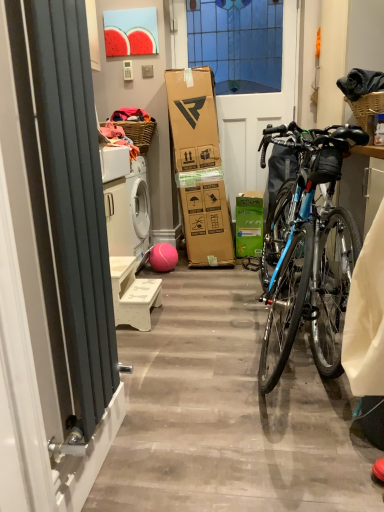
Question: Is woven brown picnic basket at upper center, the second picnic basket viewed from the front, in front of or behind rubber ball at center in the image?

Choices:
 (A) front
 (B) behind

Answer: (A)

Question: Would you say woven brown picnic basket at upper center, which is counted as the 1th picnic basket, starting from the left, is to the left or to the right of rubber ball at center in the picture?

Choices:
 (A) left
 (B) right

Answer: (A)

Question: Which object is the farthest from the dark blue fabric at upper right?

Choices:
 (A) white matte bench at lower center
 (B) white plastic power outlet at upper center
 (C) matte black radiator at left
 (D) rubber ball at center
 (E) white glossy door at center

Answer: (C)

Question: Estimate the real-world distances between objects in this image. Which object is closer to the rubber ball at center?

Choices:
 (A) white matte bench at lower center
 (B) white glossy door at center
 (C) woven brown picnic basket at upper center, which is counted as the 1th picnic basket, starting from the left
 (D) dark blue fabric at upper right
 (E) green matte box at center

Answer: (E)